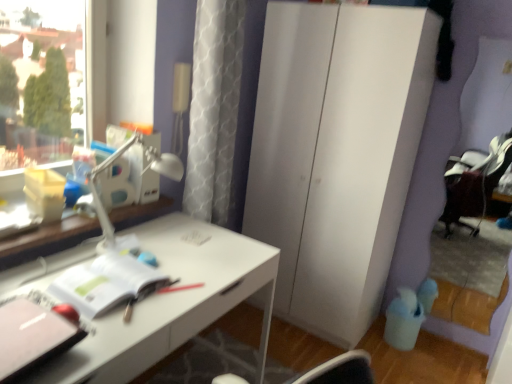
The image size is (512, 384). In order to click on space that is in front of white matte notebook at center, the 1th notebook when ordered from back to front in this screenshot , I will do tap(118, 334).